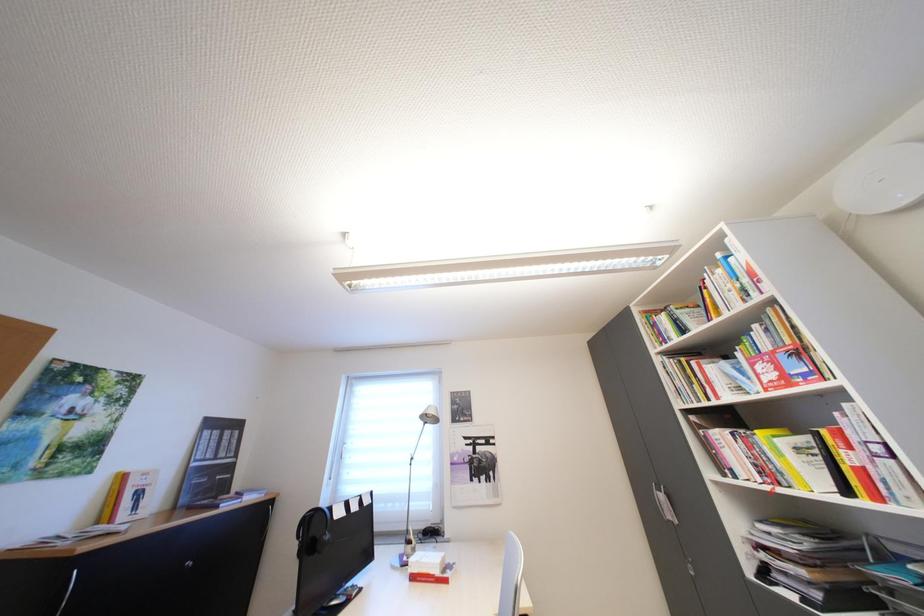
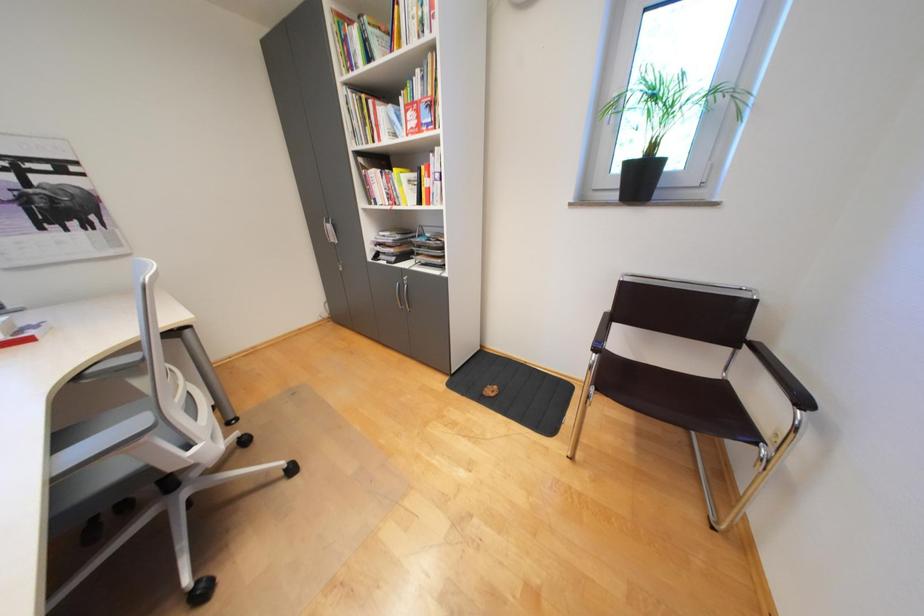
The first image is from the beginning of the video and the second image is from the end. How did the camera likely rotate when shooting the video?

The camera rotated toward right-down.